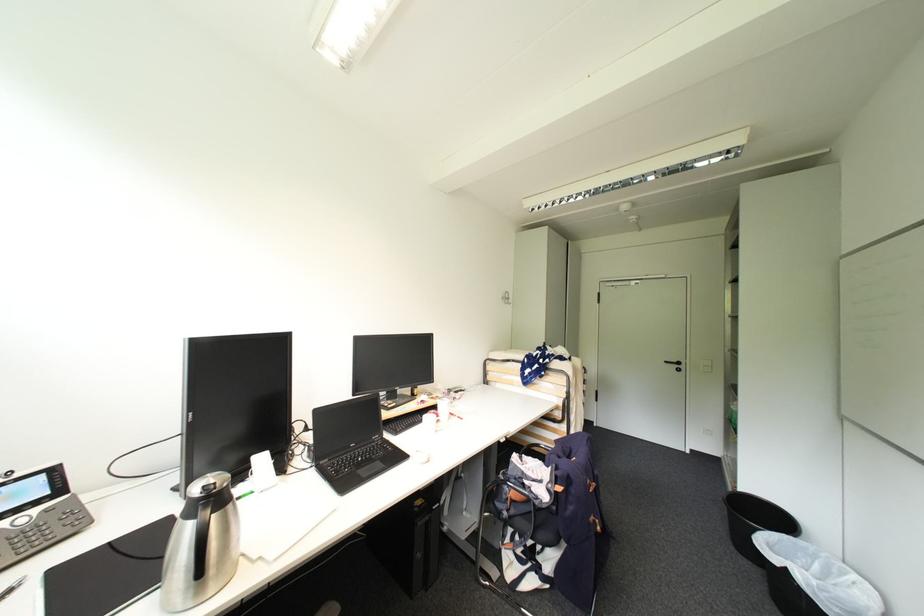
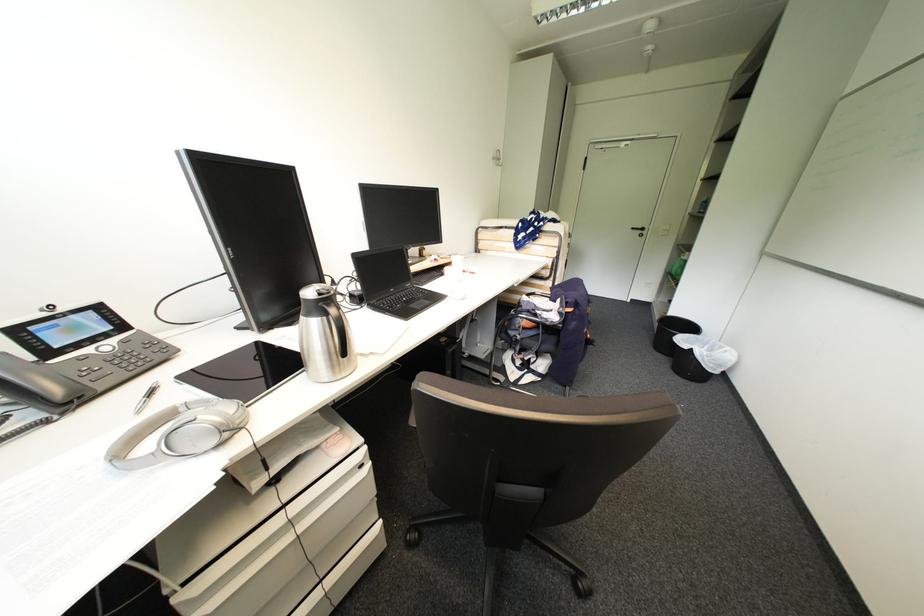
Find the pixel in the second image that matches pixel 684 367 in the first image.

(648, 233)